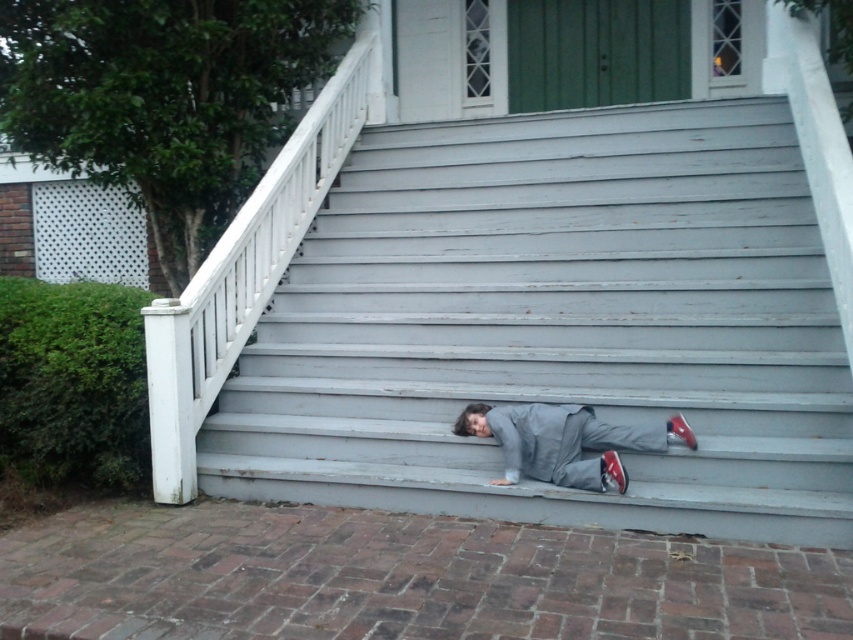
You are a drone operator trying to capture a photo of the smooth gray stairs at center. The drone is currently hovering at point A, which is at coordinates 0.4, 0.6. To get the best shot, you need to move the drone to the exact location of the stairs. In which direction should you move the drone horizontally? Specify left, right, up, or down.

The smooth gray stairs at center is located at point (556, 324). Since the drone is at (511, 256), it needs to move right and up to reach the stairs.

Looking at this image, you are a photographer taking a picture of the gray matte jacket at lower center and the shiny red shoe at lower right. Which object should you focus on first if you want to capture both in sharp focus?

The gray matte jacket at lower center is in front of the shiny red shoe at lower right, so you should focus on the gray matte jacket at lower center first to ensure both are in sharp focus.

You are standing at the bottom of the stairs and want to place a small package between the gray matte jacket at lower center and the shiny red shoe at lower right. Can you fit it there?

The gray matte jacket at lower center is to the left of shiny red shoe at lower right, so there is space between them to place the small package.